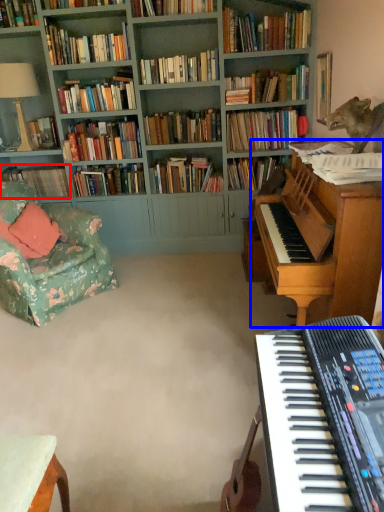
Question: Which object appears closest to the camera in this image, book (highlighted by a red box) or piano (highlighted by a blue box)?

Choices:
 (A) book
 (B) piano

Answer: (B)